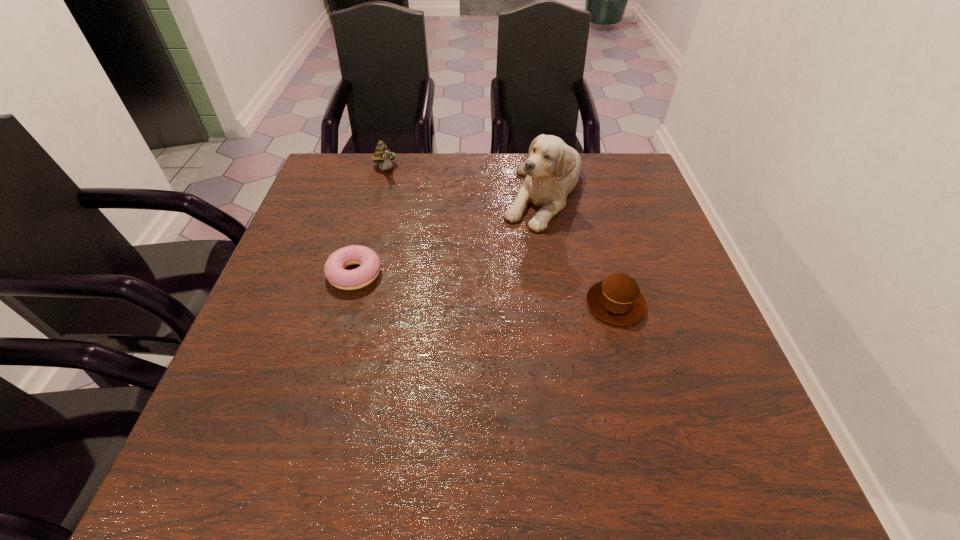
Locate an element on the screen. Image resolution: width=960 pixels, height=540 pixels. vacant spot on the desktop that is between the shortest object and the muffin and is positioned on the front-facing side of the tallest object is located at coordinates (510, 292).

Locate an element on the screen. The height and width of the screenshot is (540, 960). free space on the desktop that is between the shortest object and the muffin and is positioned on the face of the second tallest object is located at coordinates (443, 284).